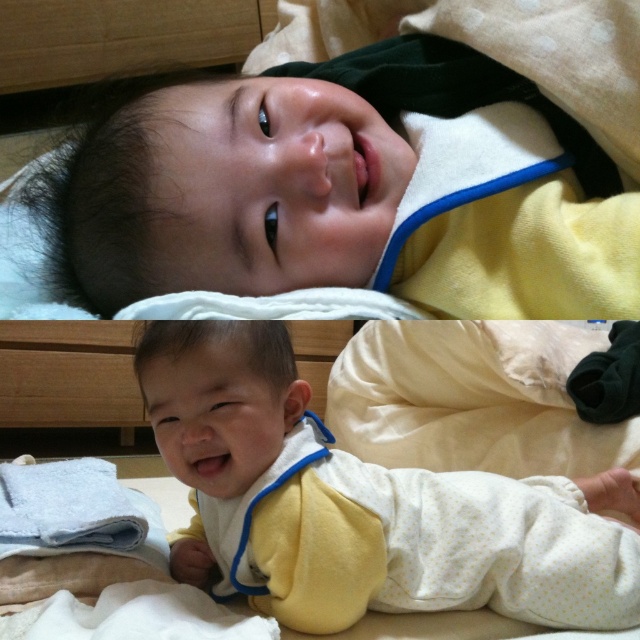
Based on the coordinates provided, which baby in the image is located at point (x=340, y=189)?

The point (x=340, y=189) indicates the yellow fleece baby at upper center.

Based on the scene description, can you determine which object, the yellow fleece baby at upper center or the yellow dotted fabric at center, is shorter in height?

The yellow fleece baby at upper center is shorter in height compared to the yellow dotted fabric at center according to the description.

You are a photographer setting up a studio for a baby photoshoot. You have a yellow fleece baby at upper center and a yellow dotted fabric at center. Which object should you place closer to the camera to ensure the smaller one appears larger in the photo?

The yellow fleece baby at upper center is smaller than the yellow dotted fabric at center, so to make the smaller one appear larger in the photo, you should place the yellow fleece baby at upper center closer to the camera.